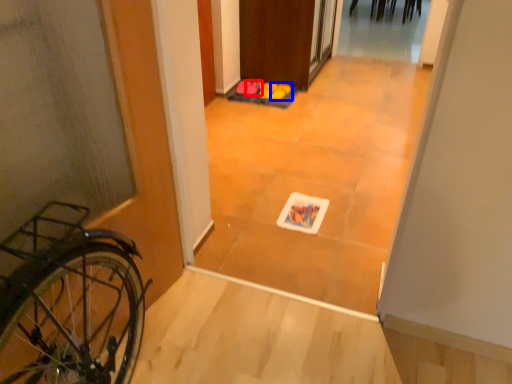
Question: Which object appears farthest to the camera in this image, footwear (highlighted by a red box) or footwear (highlighted by a blue box)?

Choices:
 (A) footwear
 (B) footwear

Answer: (A)